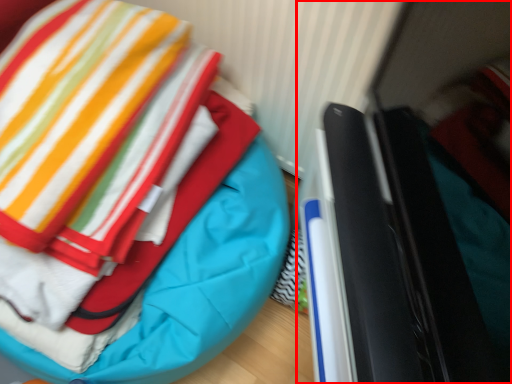
Question: Observing the image, what is the correct spatial positioning of laptop (annotated by the red box) in reference to bean bag chair?

Choices:
 (A) left
 (B) right

Answer: (B)